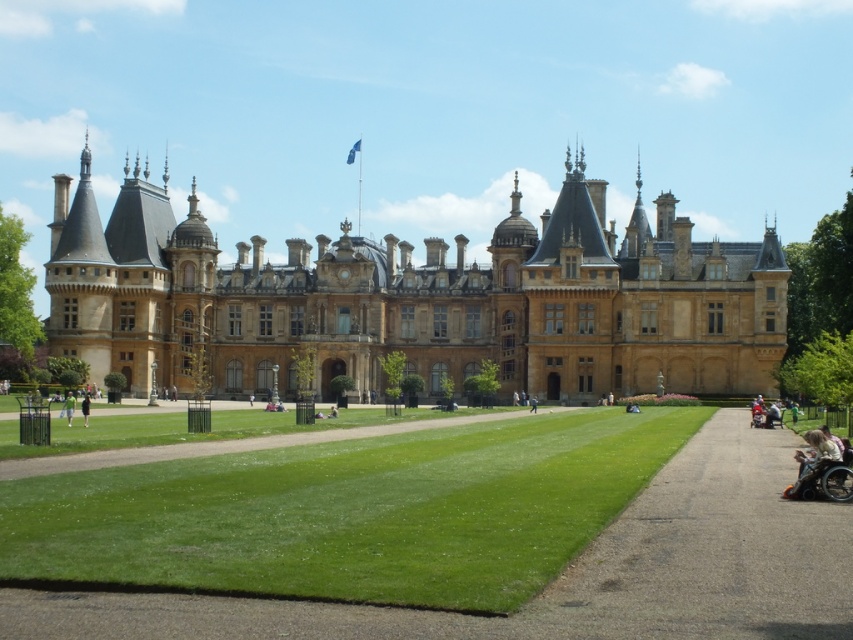
Question: Which object is positioned farthest from the green fabric shirt at lower left?

Choices:
 (A) smooth asphalt path at lower right
 (B) light brown fabric wheelchair at lower right
 (C) golden stone castle at center
 (D) green grass at center

Answer: (B)

Question: In this image, where is light brown fabric wheelchair at lower right located relative to green fabric shirt at lower left?

Choices:
 (A) left
 (B) right

Answer: (B)

Question: Which object is positioned farthest from the green fabric shirt at lower left?

Choices:
 (A) golden stone castle at center
 (B) dark brown leather jacket at center
 (C) green grass at center

Answer: (C)

Question: Which object appears farthest from the camera in this image?

Choices:
 (A) golden stone castle at center
 (B) green fabric shirt at lower left
 (C) dark brown leather jacket at center

Answer: (A)

Question: Is light brown fabric wheelchair at lower right thinner than dark brown leather jacket at center?

Choices:
 (A) no
 (B) yes

Answer: (A)

Question: Is the position of golden stone castle at center more distant than that of dark brown leather jacket at center?

Choices:
 (A) yes
 (B) no

Answer: (A)